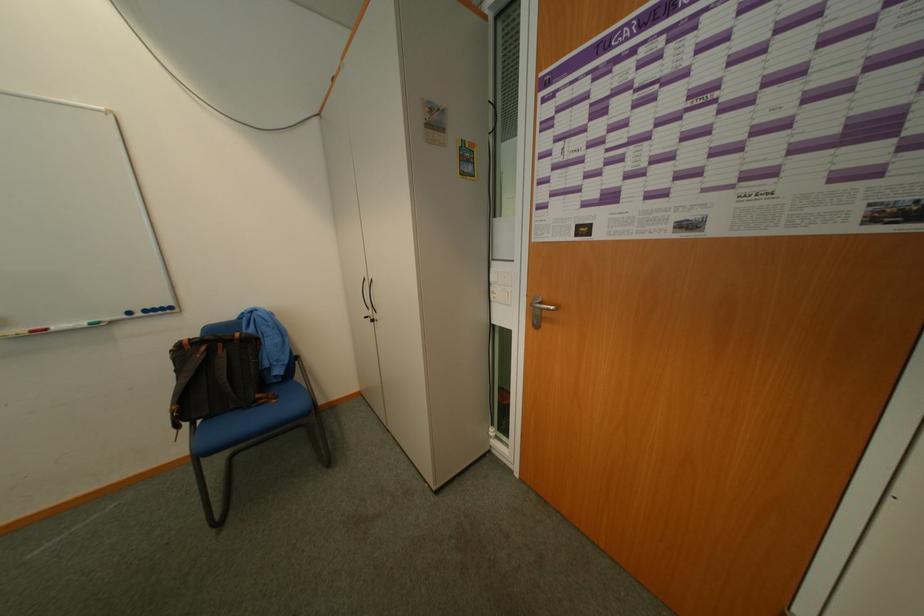
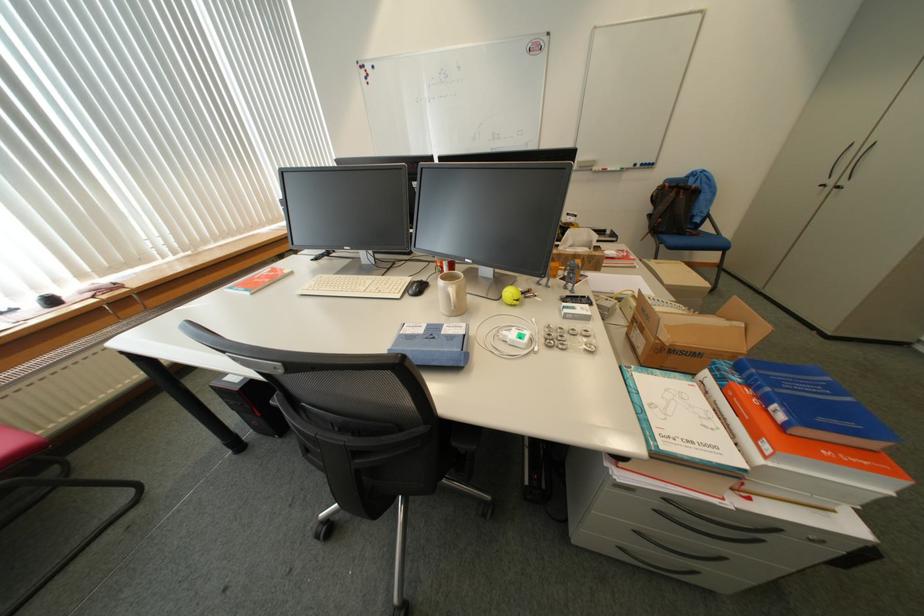
Where in the second image is the point corresponding to (221,353) from the first image?

(687, 195)